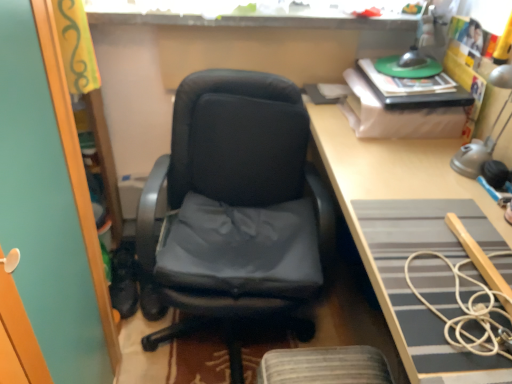
Question: From the image's perspective, is white cord at right on top of matte black office chair at center?

Choices:
 (A) yes
 (B) no

Answer: (B)

Question: Considering the relative sizes of white cord at right and matte black office chair at center in the image provided, is white cord at right wider than matte black office chair at center?

Choices:
 (A) yes
 (B) no

Answer: (B)

Question: Does white cord at right have a greater height compared to matte black office chair at center?

Choices:
 (A) no
 (B) yes

Answer: (A)

Question: Is white cord at right facing away from matte black office chair at center?

Choices:
 (A) yes
 (B) no

Answer: (B)

Question: Considering the relative sizes of white cord at right and matte black office chair at center in the image provided, is white cord at right shorter than matte black office chair at center?

Choices:
 (A) no
 (B) yes

Answer: (B)

Question: Can matte black office chair at center be found inside white cord at right?

Choices:
 (A) no
 (B) yes

Answer: (A)

Question: From the image's perspective, would you say white cord at right is positioned over light brown wooden desk at center?

Choices:
 (A) yes
 (B) no

Answer: (B)

Question: From the image's perspective, is white cord at right below light brown wooden desk at center?

Choices:
 (A) no
 (B) yes

Answer: (B)

Question: Is the depth of white cord at right greater than that of light brown wooden desk at center?

Choices:
 (A) no
 (B) yes

Answer: (B)

Question: Is white cord at right aimed at light brown wooden desk at center?

Choices:
 (A) yes
 (B) no

Answer: (A)

Question: Is white cord at right taller than light brown wooden desk at center?

Choices:
 (A) yes
 (B) no

Answer: (B)

Question: Is white cord at right positioned with its back to light brown wooden desk at center?

Choices:
 (A) no
 (B) yes

Answer: (B)

Question: Considering the relative positions of white cord at right and metallic silver table lamp at upper right in the image provided, is white cord at right to the left of metallic silver table lamp at upper right from the viewer's perspective?

Choices:
 (A) yes
 (B) no

Answer: (A)